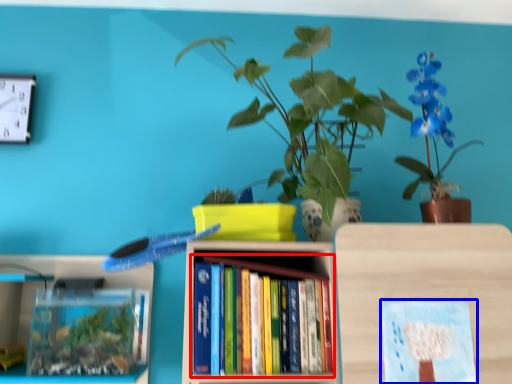
Question: Among these objects, which one is farthest to the camera, book (highlighted by a red box) or book cover (highlighted by a blue box)?

Choices:
 (A) book
 (B) book cover

Answer: (A)